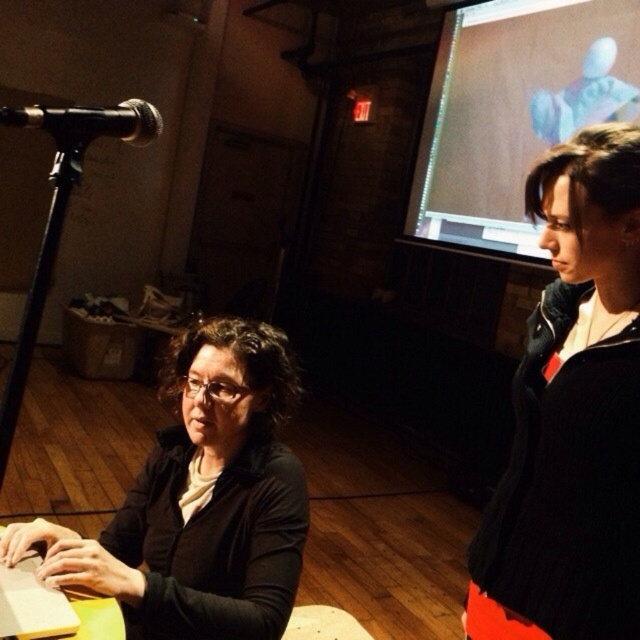
Which is in front, point (116, 134) or point (65, 612)?

Positioned in front is point (65, 612).

Between black metallic microphone at left and wooden laptop at lower left, which one appears on the left side from the viewer's perspective?

wooden laptop at lower left

Describe the element at coordinates (90, 122) in the screenshot. I see `black metallic microphone at left` at that location.

Where is `black metallic microphone at left`? This screenshot has height=640, width=640. black metallic microphone at left is located at coordinates point(90,122).

How much distance is there between matte black sweater at lower left and black metallic microphone at left?

They are 63.19 centimeters apart.

Identify the location of matte black sweater at lower left. (200, 500).

Between black knit sweater at upper right and matte brown screen at upper right, which one is positioned lower?

black knit sweater at upper right is below.

Is black knit sweater at upper right to the right of matte brown screen at upper right from the viewer's perspective?

Incorrect, black knit sweater at upper right is not on the right side of matte brown screen at upper right.

The height and width of the screenshot is (640, 640). Find the location of `black knit sweater at upper right`. black knit sweater at upper right is located at coordinates (576, 406).